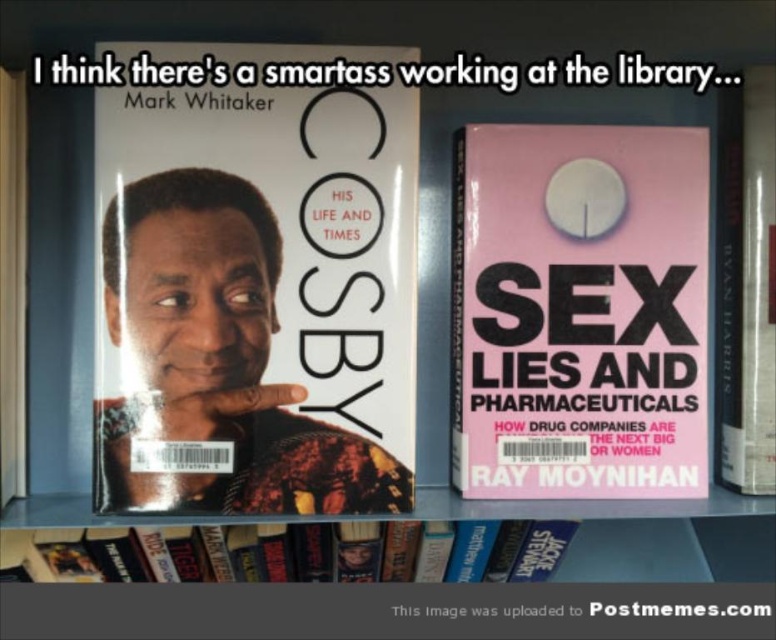
Question: Can you confirm if matte black book cover at center is positioned to the right of pink matte book cover at center?

Choices:
 (A) no
 (B) yes

Answer: (A)

Question: Considering the real-world distances, which object is closest to the pink matte book cover at center?

Choices:
 (A) hardcover book at center
 (B) matte black book cover at center

Answer: (A)

Question: Can you confirm if hardcover book at lower center is bigger than hardcover book at center?

Choices:
 (A) no
 (B) yes

Answer: (B)

Question: Which point appears farthest from the camera in this image?

Choices:
 (A) (629, 365)
 (B) (501, 548)

Answer: (B)

Question: Estimate the real-world distances between objects in this image. Which object is farther from the hardcover book at lower center?

Choices:
 (A) hardcover book at center
 (B) matte black book cover at center
 (C) pink matte book cover at center

Answer: (A)

Question: Does hardcover book at lower center have a larger size compared to hardcover book at center?

Choices:
 (A) no
 (B) yes

Answer: (B)